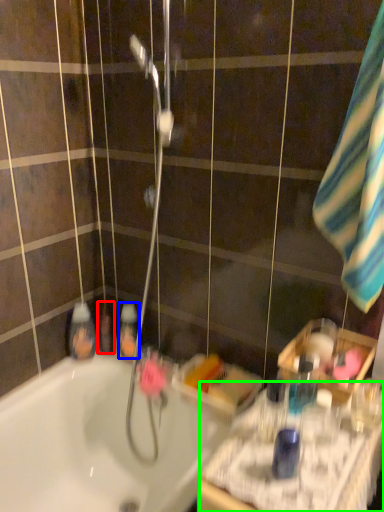
Question: Based on their relative distances, which object is farther from mouthwash (highlighted by a red box)? Choose from mouthwash (highlighted by a blue box) and counter top (highlighted by a green box).

Choices:
 (A) mouthwash
 (B) counter top

Answer: (B)